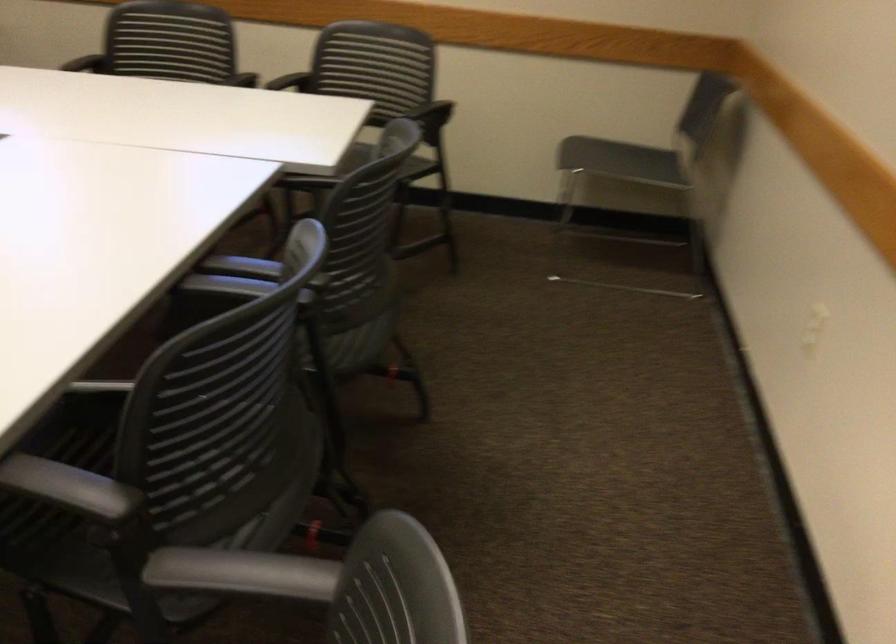
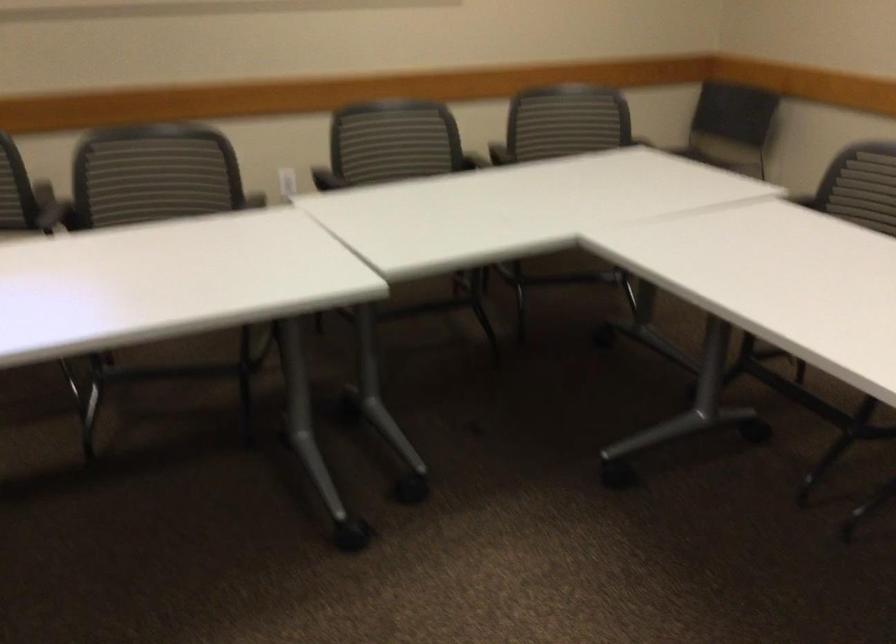
The point at (x=528, y=80) is marked in the first image. Where is the corresponding point in the second image?

(569, 114)